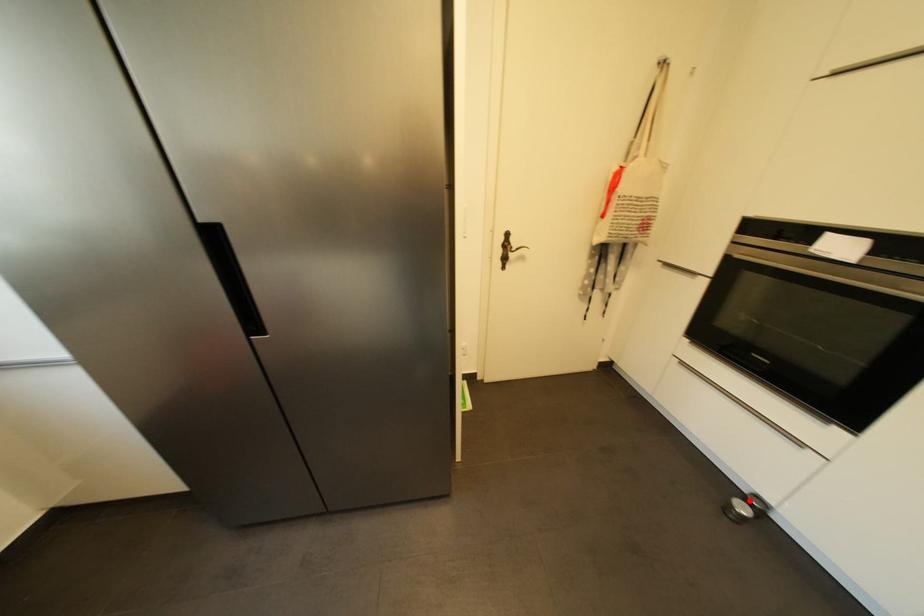
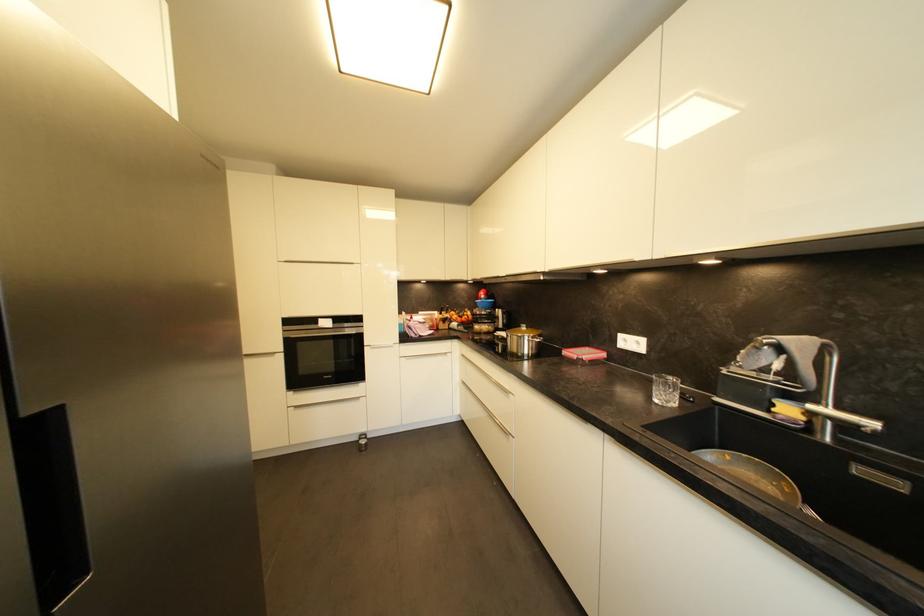
Question: I am providing you with two images of the same scene from different viewpoints. A red point is shown in image1. For the corresponding object point in image2, is it positioned nearer or farther from the camera?

Choices:
 (A) Nearer
 (B) Farther

Answer: (B)